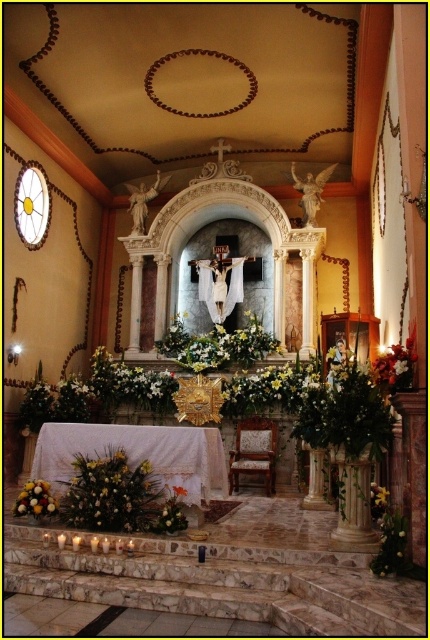
The width and height of the screenshot is (430, 640). Describe the element at coordinates (395, 368) in the screenshot. I see `white silk flowers at right` at that location.

Does point (408, 349) come in front of point (24, 500)?

Yes, it is.

Locate an element on the screen. This screenshot has width=430, height=640. white silk flowers at right is located at coordinates (395, 368).

Can you confirm if white silk flowers at right is positioned to the left of yellow matte flower at lower center?

Incorrect, white silk flowers at right is not on the left side of yellow matte flower at lower center.

Between white silk flowers at right and yellow matte flower at lower center, which one is positioned lower?

Positioned lower is yellow matte flower at lower center.

Is point (408, 346) behind point (177, 490)?

No, (408, 346) is in front of (177, 490).

Where is `white silk flowers at right`? white silk flowers at right is located at coordinates (395, 368).

Based on the photo, is the position of white silk flowers at right more distant than that of yellow matte flower at lower right?

No, white silk flowers at right is closer to the viewer.

Is white silk flowers at right above yellow matte flower at lower right?

Yes.

Does point (401, 371) come closer to viewer compared to point (384, 496)?

Yes.

In order to click on white silk flowers at right in this screenshot , I will do `click(395, 368)`.